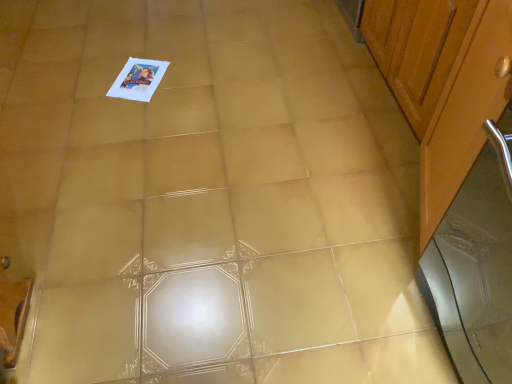
Image resolution: width=512 pixels, height=384 pixels. What are the coordinates of `vacant point to the left of silver metallic screen door at right` in the screenshot? It's located at (345, 312).